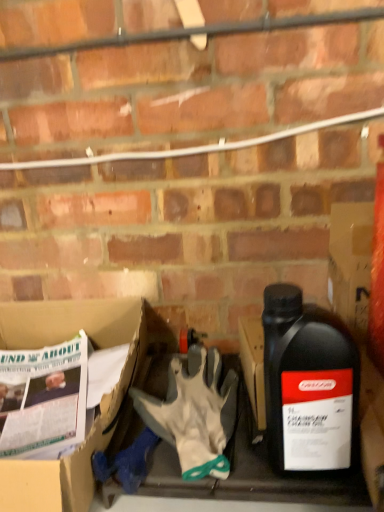
At what (x,y) coordinates should I click in order to perform the action: click on white cardboard box at lower left. Please return your answer as a coordinate pair (x, y). This screenshot has height=512, width=384. Looking at the image, I should click on (99, 406).

Can you confirm if white cardboard box at lower left is positioned to the left of white fabric glove at center?

Correct, you'll find white cardboard box at lower left to the left of white fabric glove at center.

From the image's perspective, is white cardboard box at lower left located beneath white fabric glove at center?

Indeed, from the image's perspective, white cardboard box at lower left is shown beneath white fabric glove at center.

Is white fabric glove at center surrounded by white cardboard box at lower left?

No, white fabric glove at center is not inside white cardboard box at lower left.

Could you tell me if white cardboard box at lower left is facing white fabric glove at center?

No, white cardboard box at lower left is not aimed at white fabric glove at center.

Is black plastic bottle at right aimed at white cardboard box at lower left?

No, black plastic bottle at right does not turn towards white cardboard box at lower left.

How many degrees apart are the facing directions of black plastic bottle at right and white cardboard box at lower left?

They differ by 1.24 degrees in their facing directions.

Consider the image. Is black plastic bottle at right to the left or to the right of white cardboard box at lower left in the image?

In the image, black plastic bottle at right appears on the right side of white cardboard box at lower left.

In the scene shown: Which of these two, black plastic bottle at right or white cardboard box at lower left, is wider?

With larger width is white cardboard box at lower left.

Is white fabric glove at center wider than white cardboard box at lower left?

Incorrect, the width of white fabric glove at center does not surpass that of white cardboard box at lower left.

Is white fabric glove at center spatially inside white cardboard box at lower left, or outside of it?

white fabric glove at center is not inside white cardboard box at lower left, it's outside.

Which of these two, white fabric glove at center or white cardboard box at lower left, is smaller?

Smaller between the two is white fabric glove at center.

Could you tell me if white fabric glove at center is facing white cardboard box at lower left?

No, white fabric glove at center is not aimed at white cardboard box at lower left.

Does point (63, 308) come farther from viewer compared to point (321, 398)?

Yes, point (63, 308) is farther from viewer.

Is white cardboard box at lower left located outside black plastic bottle at right?

Absolutely, white cardboard box at lower left is external to black plastic bottle at right.

Measure the distance from white cardboard box at lower left to black plastic bottle at right.

12.45 inches.

What's the angular difference between white cardboard box at lower left and black plastic bottle at right's facing directions?

The facing directions of white cardboard box at lower left and black plastic bottle at right are 1.24 degrees apart.

Is white fabric glove at center oriented away from black plastic bottle at right?

white fabric glove at center is not turned away from black plastic bottle at right.

Is white fabric glove at center at the right side of black plastic bottle at right?

No, white fabric glove at center is not to the right of black plastic bottle at right.

Is white fabric glove at center with black plastic bottle at right?

No, white fabric glove at center is not in contact with black plastic bottle at right.

Considering their positions, is white fabric glove at center located in front of or behind black plastic bottle at right?

Visually, white fabric glove at center is located behind black plastic bottle at right.

How different are the orientations of black plastic bottle at right and white fabric glove at center in degrees?

black plastic bottle at right and white fabric glove at center are facing 9.02 degrees away from each other.

Which is more to the right, black plastic bottle at right or white fabric glove at center?

Positioned to the right is black plastic bottle at right.

How far apart are black plastic bottle at right and white fabric glove at center?

black plastic bottle at right is 5.27 inches away from white fabric glove at center.

Does point (345, 348) come in front of point (205, 351)?

Yes, it is in front of point (205, 351).

Find the location of `box in front of the white fabric glove at center`. box in front of the white fabric glove at center is located at coordinates (99, 406).

Identify the location of box on the left of the black plastic bottle at right. (99, 406).

Considering their positions, is white cardboard box at lower left positioned further to white fabric glove at center than black plastic bottle at right?

Based on the image, white cardboard box at lower left appears to be further to white fabric glove at center.

When comparing their distances from white cardboard box at lower left, does white fabric glove at center or black plastic bottle at right seem further?

black plastic bottle at right is further to white cardboard box at lower left.

Which object lies further to the anchor point white fabric glove at center, black plastic bottle at right or white cardboard box at lower left?

white cardboard box at lower left.

Estimate the real-world distances between objects in this image. Which object is further from white cardboard box at lower left, black plastic bottle at right or white fabric glove at center?

The object further to white cardboard box at lower left is black plastic bottle at right.

Based on their spatial positions, is white cardboard box at lower left or white fabric glove at center closer to black plastic bottle at right?

white fabric glove at center is positioned closer to the anchor black plastic bottle at right.

Based on their spatial positions, is white fabric glove at center or white cardboard box at lower left further from black plastic bottle at right?

white cardboard box at lower left is further to black plastic bottle at right.

Locate an element on the screen. glove between white cardboard box at lower left and black plastic bottle at right from left to right is located at coordinates (194, 413).